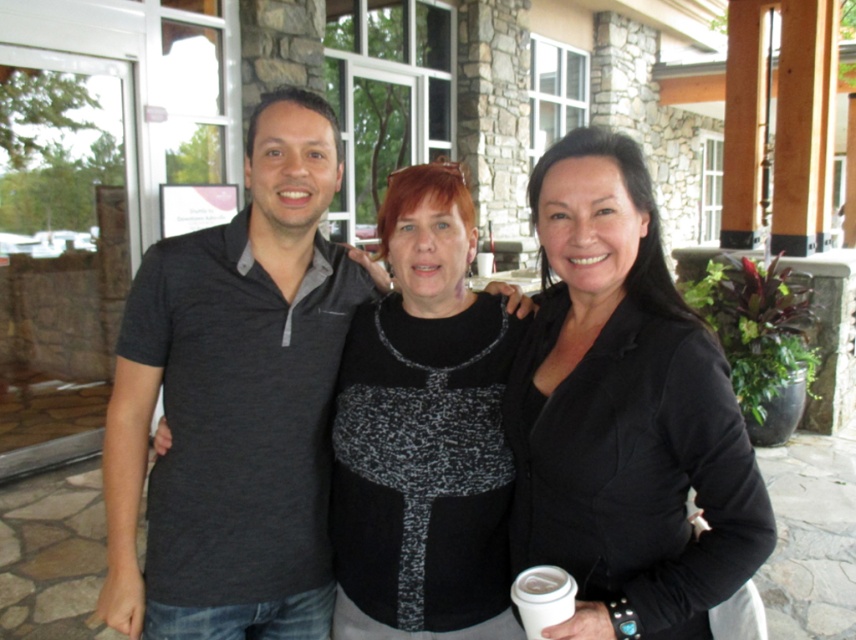
Question: Does dark gray jersey at center have a larger size compared to speckled knit sweater at center?

Choices:
 (A) yes
 (B) no

Answer: (A)

Question: Can you confirm if black matte blazer at center is positioned above white paper cup at lower center?

Choices:
 (A) yes
 (B) no

Answer: (A)

Question: Can you confirm if dark gray jersey at center is positioned below white paper cup at lower center?

Choices:
 (A) yes
 (B) no

Answer: (B)

Question: Which point is closer to the camera taking this photo?

Choices:
 (A) (544, 588)
 (B) (652, 352)
 (C) (461, 304)
 (D) (306, 429)

Answer: (B)

Question: Among these points, which one is nearest to the camera?

Choices:
 (A) (551, 243)
 (B) (458, 518)
 (C) (290, 289)

Answer: (A)

Question: Which object is the farthest from the black matte blazer at center?

Choices:
 (A) dark gray jersey at center
 (B) speckled knit sweater at center

Answer: (A)